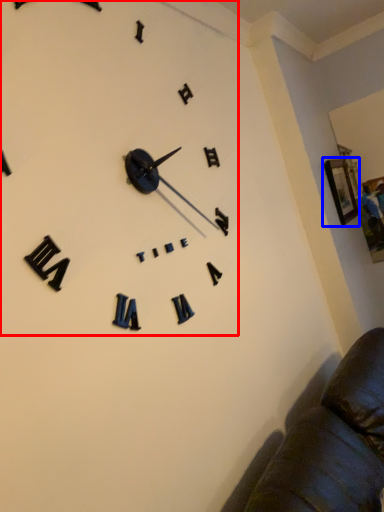
Question: Which object appears farthest to the camera in this image, clock (highlighted by a red box) or picture frame (highlighted by a blue box)?

Choices:
 (A) clock
 (B) picture frame

Answer: (B)